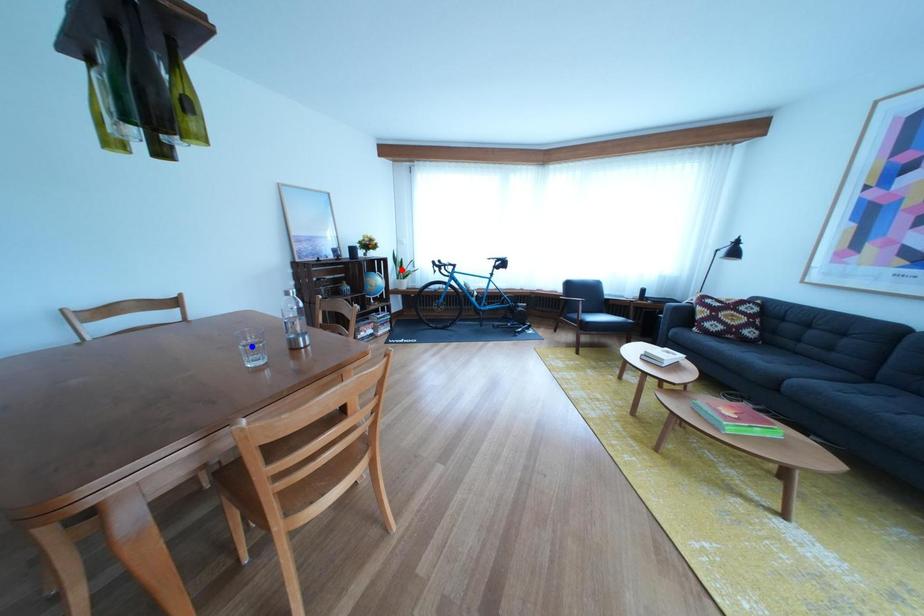
Question: Which of the two points in the image is closer to the camera?

Choices:
 (A) Blue point is closer.
 (B) Red point is closer.

Answer: (A)